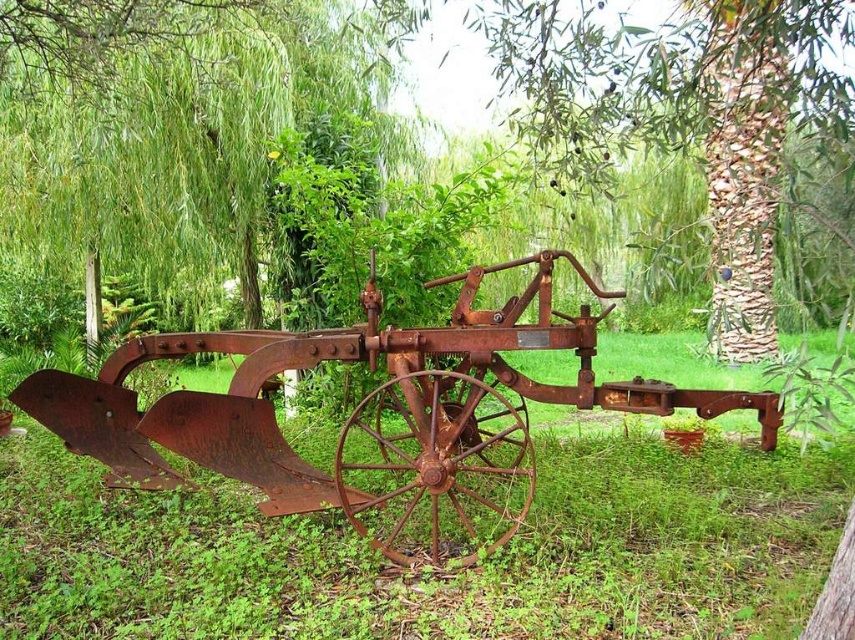
You are a gardener who needs to move a 2.5 meter long hose from the rusty metal tractor at center to the rusty metal tree at center. Can you place the hose end to end between them without bending it?

The distance between the rusty metal tractor at center and the rusty metal tree at center is 2.08 meters, which is shorter than the 2.5 meter hose. Therefore, the hose cannot be placed end to end without bending it.

You are standing in the garden and see the point marked at coordinates (369, 413). What object is located at that point?

The point at coordinates (369, 413) indicates the location of the rusty metal tractor at center.

You are standing in the garden and want to take a photo of both the rusty metal tractor at center and the rusty metal tree at center. Which one should you focus on first to ensure both are in the frame?

You should focus on the rusty metal tractor at center first because it is closer to you than the rusty metal tree at center, so adjusting the camera to capture it ensures the tree in the background will also be in the frame.